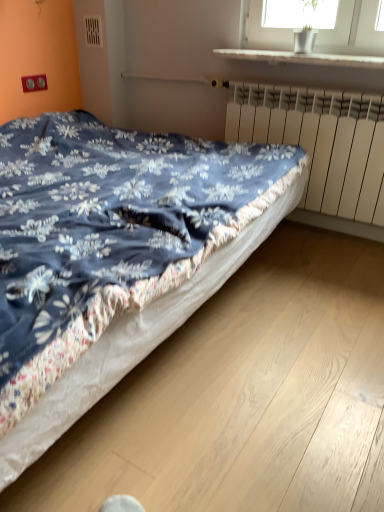
Question: Considering the relative positions of white glossy window sill at upper center and white matte radiator at right in the image provided, is white glossy window sill at upper center behind white matte radiator at right?

Choices:
 (A) no
 (B) yes

Answer: (A)

Question: From a real-world perspective, is white glossy window sill at upper center under white matte radiator at right?

Choices:
 (A) yes
 (B) no

Answer: (B)

Question: Is white glossy window sill at upper center looking in the opposite direction of white matte radiator at right?

Choices:
 (A) no
 (B) yes

Answer: (A)

Question: Is white glossy window sill at upper center at the right side of white matte radiator at right?

Choices:
 (A) yes
 (B) no

Answer: (B)

Question: From a real-world perspective, does white glossy window sill at upper center stand above white matte radiator at right?

Choices:
 (A) no
 (B) yes

Answer: (B)

Question: Is white glossy window sill at upper center outside white matte radiator at right?

Choices:
 (A) no
 (B) yes

Answer: (B)

Question: Is white matte radiator at right not within white glossy window sill at upper center?

Choices:
 (A) no
 (B) yes

Answer: (B)

Question: From the image's perspective, does white matte radiator at right appear higher than white glossy window sill at upper center?

Choices:
 (A) yes
 (B) no

Answer: (B)

Question: From a real-world perspective, is white matte radiator at right located higher than white glossy window sill at upper center?

Choices:
 (A) no
 (B) yes

Answer: (A)

Question: Is white matte radiator at right facing away from white glossy window sill at upper center?

Choices:
 (A) yes
 (B) no

Answer: (B)

Question: From the image's perspective, is white matte radiator at right below white glossy window sill at upper center?

Choices:
 (A) no
 (B) yes

Answer: (B)

Question: Can you confirm if white matte radiator at right is taller than white glossy window sill at upper center?

Choices:
 (A) no
 (B) yes

Answer: (B)

Question: Is blue floral fabric bed at center closer to the viewer compared to white matte radiator at right?

Choices:
 (A) no
 (B) yes

Answer: (B)